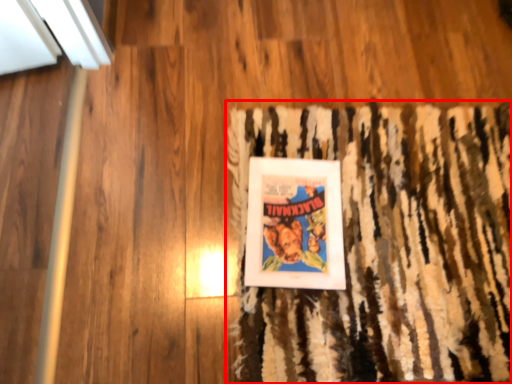
Question: From the image's perspective, what is the correct spatial positioning of doormat (annotated by the red box) in reference to picture frame?

Choices:
 (A) below
 (B) above

Answer: (A)